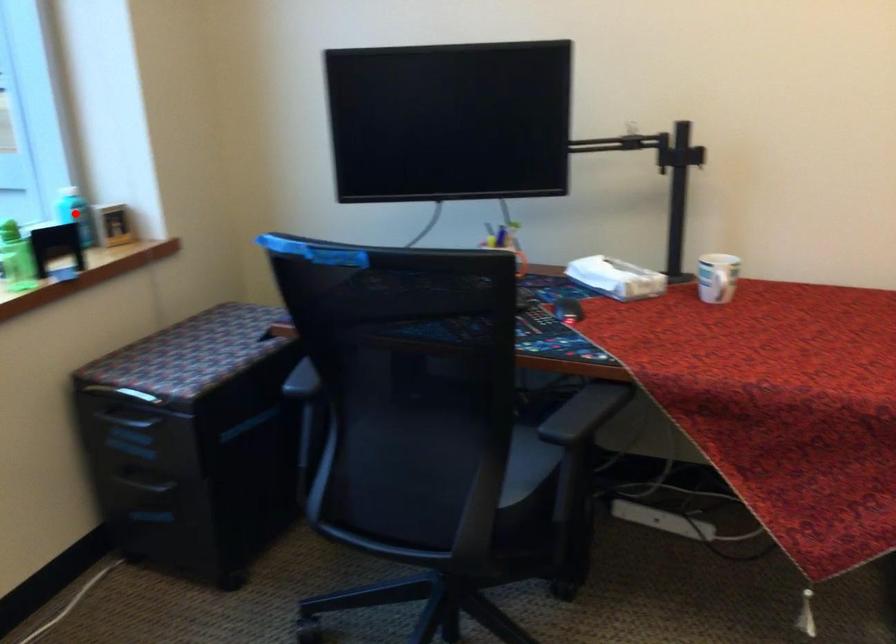
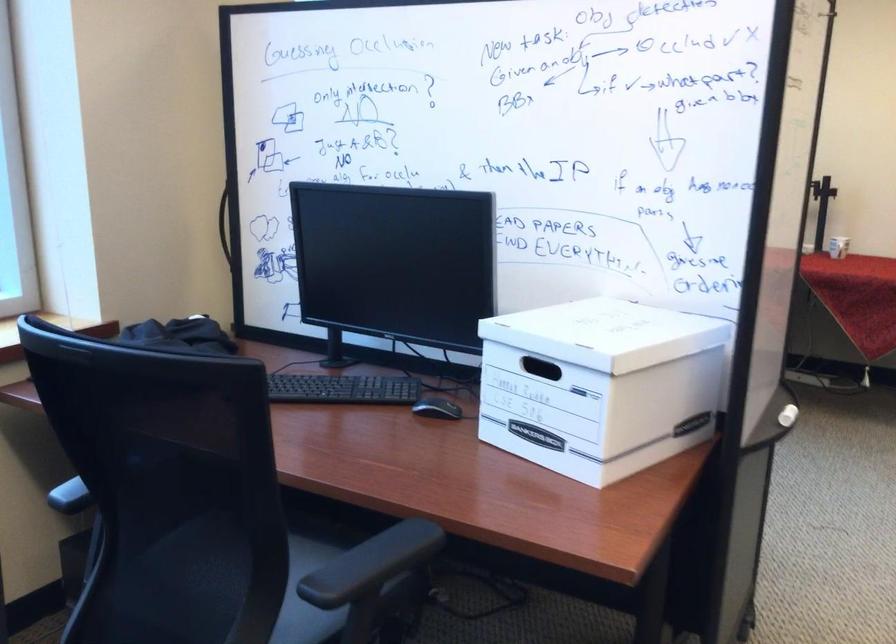
Question: I am providing you with two images of the same scene from different viewpoints. A red point is marked on the first image. At the location where the point appears in image 1, is it still visible in image 2?

Choices:
 (A) Yes
 (B) No

Answer: (B)